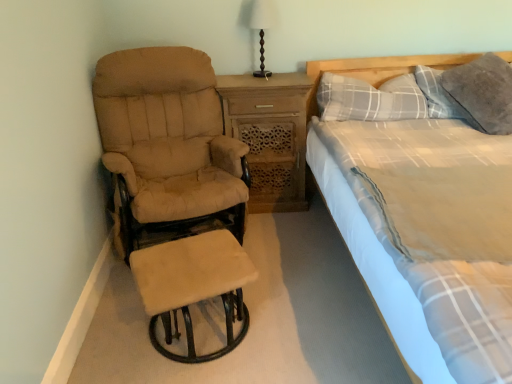
Locate an element on the screen. This screenshot has width=512, height=384. wooden nightstand at center is located at coordinates (269, 135).

What is the approximate width of gray plaid pillow at upper right, marked as the 1th pillow in a left-to-right arrangement?

gray plaid pillow at upper right, marked as the 1th pillow in a left-to-right arrangement, is 12.76 inches wide.

The width and height of the screenshot is (512, 384). What do you see at coordinates (175, 186) in the screenshot? I see `beige fabric recliner at left` at bounding box center [175, 186].

Image resolution: width=512 pixels, height=384 pixels. What do you see at coordinates (482, 93) in the screenshot? I see `gray soft pillow at upper right, marked as the first pillow in a right-to-left arrangement` at bounding box center [482, 93].

At what (x,y) coordinates should I click in order to perform the action: click on gray soft pillow at upper right, the 2th pillow viewed from the left. Please return your answer as a coordinate pair (x, y). This screenshot has width=512, height=384. Looking at the image, I should click on (482, 93).

Where is `matte brown wooden lamp at upper center`? The image size is (512, 384). matte brown wooden lamp at upper center is located at coordinates (262, 28).

From a real-world perspective, who is located higher, light gray plaid fabric bed at right or gray plaid pillow at upper right, the 2th pillow viewed from the right?

gray plaid pillow at upper right, the 2th pillow viewed from the right, from a real-world perspective.

Which of these two, light gray plaid fabric bed at right or gray plaid pillow at upper right, the 2th pillow viewed from the right, stands shorter?

With less height is gray plaid pillow at upper right, the 2th pillow viewed from the right.

Is light gray plaid fabric bed at right not inside gray plaid pillow at upper right, marked as the 1th pillow in a left-to-right arrangement?

Yes, light gray plaid fabric bed at right is outside of gray plaid pillow at upper right, marked as the 1th pillow in a left-to-right arrangement.

Is light gray plaid fabric bed at right wider or thinner than gray plaid pillow at upper right, the 2th pillow viewed from the right?

Considering their sizes, light gray plaid fabric bed at right looks broader than gray plaid pillow at upper right, the 2th pillow viewed from the right.

Is light gray plaid fabric bed at right inside or outside of matte brown wooden lamp at upper center?

light gray plaid fabric bed at right exists outside the volume of matte brown wooden lamp at upper center.

Considering the sizes of light gray plaid fabric bed at right and matte brown wooden lamp at upper center in the image, is light gray plaid fabric bed at right wider or thinner than matte brown wooden lamp at upper center?

Clearly, light gray plaid fabric bed at right has more width compared to matte brown wooden lamp at upper center.

The width and height of the screenshot is (512, 384). Find the location of `bed that is in front of the matte brown wooden lamp at upper center`. bed that is in front of the matte brown wooden lamp at upper center is located at coordinates (368, 268).

Is point (415, 57) positioned behind point (267, 72)?

Yes, point (415, 57) is behind point (267, 72).

Measure the distance between beige fabric recliner at left and gray plaid pillow at upper right, marked as the 1th pillow in a left-to-right arrangement.

38.35 inches.

From a real-world perspective, which object rests below the other?

From a 3D spatial view, beige fabric recliner at left is below.

Is beige fabric recliner at left looking in the opposite direction of gray plaid pillow at upper right, marked as the 1th pillow in a left-to-right arrangement?

No.

Can we say beige fabric recliner at left lies outside gray plaid pillow at upper right, marked as the 1th pillow in a left-to-right arrangement?

Yes, beige fabric recliner at left is outside of gray plaid pillow at upper right, marked as the 1th pillow in a left-to-right arrangement.

From a real-world perspective, is beige suede stool at lower left positioned above or below matte brown wooden lamp at upper center?

From a real-world perspective, beige suede stool at lower left is physically below matte brown wooden lamp at upper center.

Where is `bar stool that is below the matte brown wooden lamp at upper center (from the image's perspective)`? Image resolution: width=512 pixels, height=384 pixels. bar stool that is below the matte brown wooden lamp at upper center (from the image's perspective) is located at coordinates (193, 285).

Are beige suede stool at lower left and matte brown wooden lamp at upper center located far from each other?

→ Yes.

Which object is closer to the camera, beige suede stool at lower left or matte brown wooden lamp at upper center?

beige suede stool at lower left is in front.

Is gray soft pillow at upper right, the 2th pillow viewed from the left, further to the viewer compared to light gray plaid fabric bed at right?

Yes, it is behind light gray plaid fabric bed at right.

From a real-world perspective, which object rests below the other?

light gray plaid fabric bed at right, from a real-world perspective.

Would you say gray soft pillow at upper right, marked as the first pillow in a right-to-left arrangement, contains light gray plaid fabric bed at right?

No, light gray plaid fabric bed at right is located outside of gray soft pillow at upper right, marked as the first pillow in a right-to-left arrangement.

Which is more distant, (509, 92) or (320, 169)?

The point (509, 92) is farther.

From a real-world perspective, is gray plaid pillow at upper right, the 2th pillow viewed from the right, beneath light gray plaid fabric bed at right?

No, from a real-world perspective, gray plaid pillow at upper right, the 2th pillow viewed from the right, is not beneath light gray plaid fabric bed at right.

Is light gray plaid fabric bed at right at the back of gray plaid pillow at upper right, marked as the 1th pillow in a left-to-right arrangement?

Yes, light gray plaid fabric bed at right is at the back of gray plaid pillow at upper right, marked as the 1th pillow in a left-to-right arrangement.

In terms of width, does gray plaid pillow at upper right, the 2th pillow viewed from the right, look wider or thinner when compared to light gray plaid fabric bed at right?

gray plaid pillow at upper right, the 2th pillow viewed from the right, is thinner than light gray plaid fabric bed at right.

Is gray plaid pillow at upper right, the 2th pillow viewed from the right, taller or shorter than light gray plaid fabric bed at right?

In the image, gray plaid pillow at upper right, the 2th pillow viewed from the right, appears to be shorter than light gray plaid fabric bed at right.

Is light gray plaid fabric bed at right placed right next to wooden nightstand at center?

No, light gray plaid fabric bed at right is not in contact with wooden nightstand at center.

Is point (386, 283) farther from viewer compared to point (270, 126)?

No, it is in front of (270, 126).

Is light gray plaid fabric bed at right closer to the viewer compared to wooden nightstand at center?

Yes.

Based on their sizes in the image, would you say light gray plaid fabric bed at right is bigger or smaller than wooden nightstand at center?

Considering their sizes, light gray plaid fabric bed at right takes up more space than wooden nightstand at center.

From the image's perspective, starting from the light gray plaid fabric bed at right, which pillow is the 1st one above? Please provide its 2D coordinates.

[(370, 99)]

The width and height of the screenshot is (512, 384). Find the location of `bedside lamp above the light gray plaid fabric bed at right (from a real-world perspective)`. bedside lamp above the light gray plaid fabric bed at right (from a real-world perspective) is located at coordinates (x=262, y=28).

Based on their spatial positions, is gray plaid pillow at upper right, marked as the 1th pillow in a left-to-right arrangement, or beige fabric recliner at left closer to beige suede stool at lower left?

Among the two, beige fabric recliner at left is located nearer to beige suede stool at lower left.

Which object lies nearer to the anchor point beige fabric recliner at left, gray plaid pillow at upper right, marked as the 1th pillow in a left-to-right arrangement, or wooden nightstand at center?

wooden nightstand at center is closer to beige fabric recliner at left.

Looking at the image, which one is located closer to wooden nightstand at center, beige suede stool at lower left or beige fabric recliner at left?

Based on the image, beige fabric recliner at left appears to be nearer to wooden nightstand at center.

Looking at the image, which one is located closer to light gray plaid fabric bed at right, gray plaid pillow at upper right, marked as the 1th pillow in a left-to-right arrangement, or beige fabric recliner at left?

gray plaid pillow at upper right, marked as the 1th pillow in a left-to-right arrangement, lies closer to light gray plaid fabric bed at right than the other object.

Looking at this image, considering their positions, is beige fabric recliner at left positioned further to light gray plaid fabric bed at right than gray plaid pillow at upper right, the 2th pillow viewed from the right?

The object further to light gray plaid fabric bed at right is beige fabric recliner at left.

Based on their spatial positions, is matte brown wooden lamp at upper center or light gray plaid fabric bed at right further from wooden nightstand at center?

matte brown wooden lamp at upper center is further to wooden nightstand at center.

Based on their spatial positions, is light gray plaid fabric bed at right or gray soft pillow at upper right, the 2th pillow viewed from the left, closer to matte brown wooden lamp at upper center?

Based on the image, light gray plaid fabric bed at right appears to be nearer to matte brown wooden lamp at upper center.

When comparing their distances from beige suede stool at lower left, does beige fabric recliner at left or gray soft pillow at upper right, marked as the first pillow in a right-to-left arrangement, seem closer?

Among the two, beige fabric recliner at left is located nearer to beige suede stool at lower left.

Locate an element on the screen. The height and width of the screenshot is (384, 512). nightstand between beige fabric recliner at left and gray plaid pillow at upper right, marked as the 1th pillow in a left-to-right arrangement is located at coordinates (269, 135).

Image resolution: width=512 pixels, height=384 pixels. What are the coordinates of `chair between light gray plaid fabric bed at right and gray plaid pillow at upper right, the 2th pillow viewed from the right, along the z-axis` in the screenshot? It's located at (175, 186).

Identify the location of bar stool between beige fabric recliner at left and gray plaid pillow at upper right, marked as the 1th pillow in a left-to-right arrangement, in the horizontal direction. Image resolution: width=512 pixels, height=384 pixels. (193, 285).

Find the location of a particular element. nightstand between matte brown wooden lamp at upper center and gray soft pillow at upper right, the 2th pillow viewed from the left, from left to right is located at coordinates (269, 135).